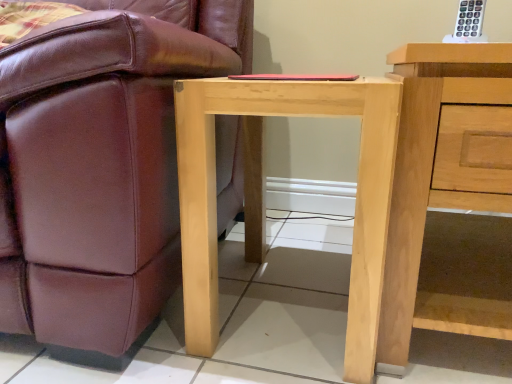
Question: Is natural wood nightstand at right wider or thinner than matte brown leather chair at lower left?

Choices:
 (A) thin
 (B) wide

Answer: (A)

Question: Is natural wood nightstand at right situated inside matte brown leather chair at lower left or outside?

Choices:
 (A) inside
 (B) outside

Answer: (B)

Question: Estimate the real-world distances between objects in this image. Which object is closer to the matte brown leather chair at lower left?

Choices:
 (A) natural wood nightstand at right
 (B) natural wood table at center

Answer: (B)

Question: Considering the real-world distances, which object is farthest from the matte brown leather chair at lower left?

Choices:
 (A) natural wood nightstand at right
 (B) natural wood table at center

Answer: (A)